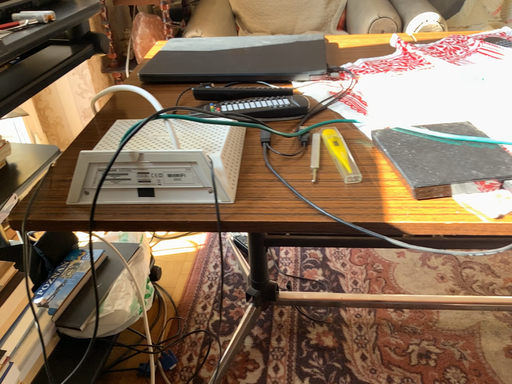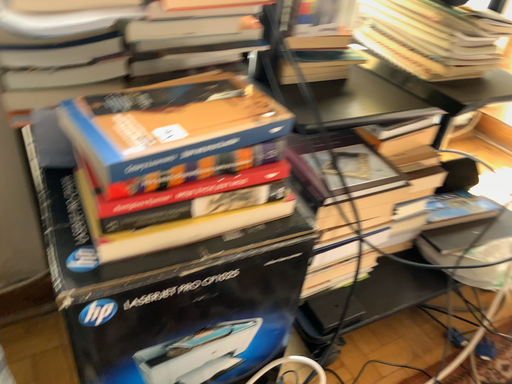
Question: Which way did the camera rotate in the video?

Choices:
 (A) rotated downward
 (B) rotated upward

Answer: (B)